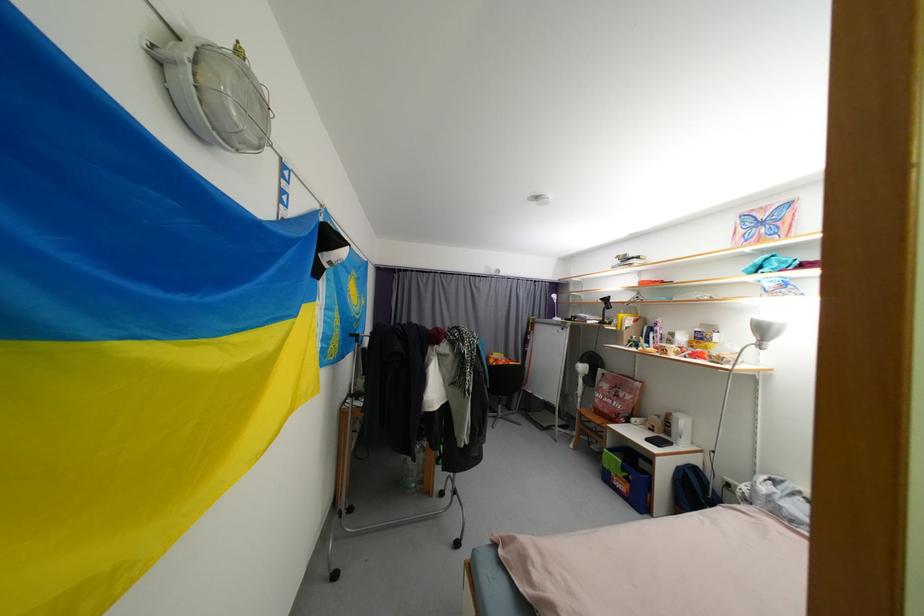
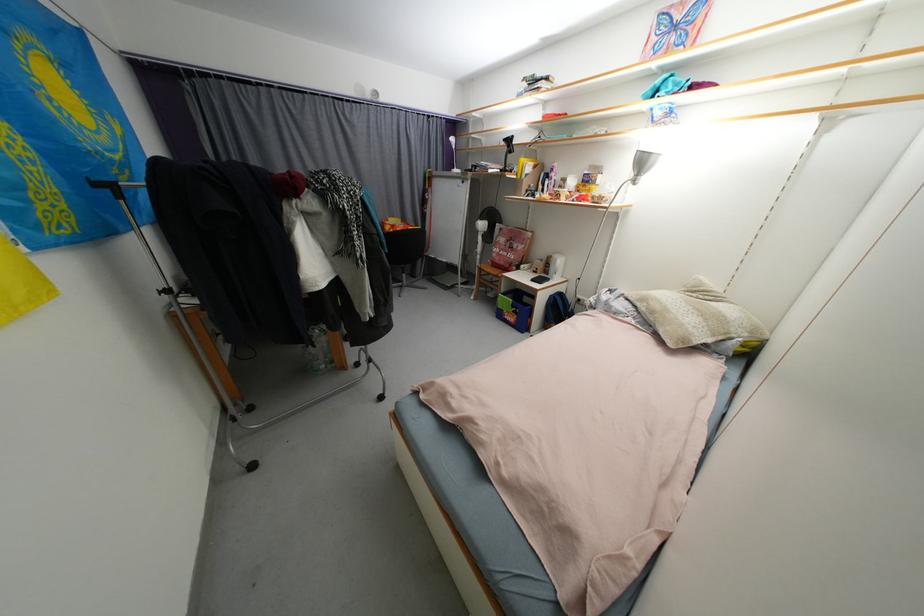
The point at (699,471) is marked in the first image. Where is the corresponding point in the second image?

(565, 297)